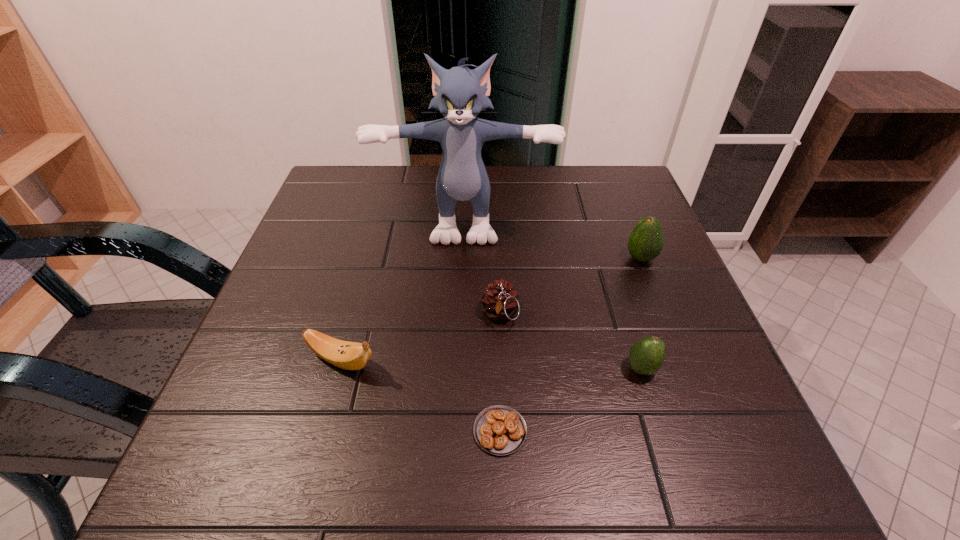
This screenshot has width=960, height=540. In the image, there is a desktop. Find the location of `vacant space at the near edge`. vacant space at the near edge is located at coordinates (535, 447).

The width and height of the screenshot is (960, 540). Identify the location of vacant space at the left edge of the desktop. (313, 329).

The height and width of the screenshot is (540, 960). Identify the location of vacant space at the right edge of the desktop. (625, 290).

In the image, there is a desktop. Where is `free space at the far left corner`? This screenshot has height=540, width=960. free space at the far left corner is located at coordinates click(x=325, y=213).

Locate an element on the screen. This screenshot has height=540, width=960. vacant position at the near left corner of the desktop is located at coordinates (193, 468).

Locate an element on the screen. This screenshot has width=960, height=540. vacant space at the far right corner is located at coordinates (625, 179).

At what (x,y) coordinates should I click in order to perform the action: click on unoccupied area between the banana and the pinecone. Please return your answer as a coordinate pair (x, y). Looking at the image, I should click on (420, 338).

Find the location of `free area in between the tallest object and the left avocado`. free area in between the tallest object and the left avocado is located at coordinates (553, 294).

Identify the location of free spot between the pinecone and the banana. This screenshot has height=540, width=960. (420, 338).

In order to click on free space between the fifth nearest object and the farthest object in this screenshot , I will do `click(553, 239)`.